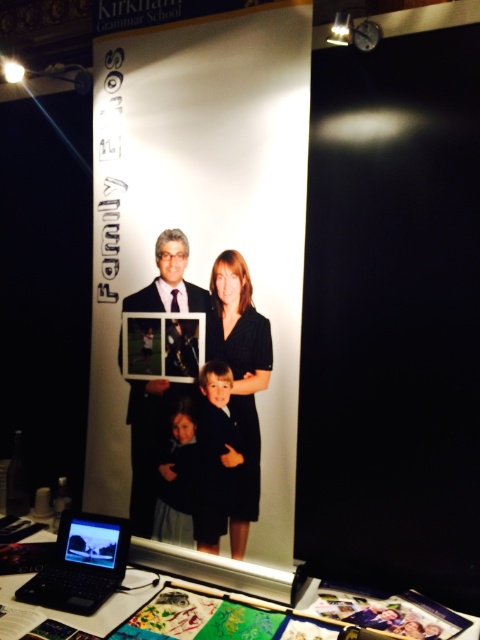
Is the position of black matte dress at center less distant than that of metallic photo frame at center?

Yes, it is in front of metallic photo frame at center.

Is black matte dress at center below metallic photo frame at center?

Correct, black matte dress at center is located below metallic photo frame at center.

Find the location of a particular element. The width and height of the screenshot is (480, 640). black matte dress at center is located at coordinates (240, 380).

Is silver metallic laptop at lower left to the left of metallic photo frame at center from the viewer's perspective?

Correct, you'll find silver metallic laptop at lower left to the left of metallic photo frame at center.

Does silver metallic laptop at lower left appear over metallic photo frame at center?

Incorrect, silver metallic laptop at lower left is not positioned above metallic photo frame at center.

What are the coordinates of `silver metallic laptop at lower left` in the screenshot? It's located at (81, 564).

Based on the photo, who is lower down, black matte dress at center or matte black suit at center?

black matte dress at center

Who is shorter, black matte dress at center or matte black suit at center?

With less height is black matte dress at center.

At what (x,y) coordinates should I click in order to perform the action: click on black matte dress at center. Please return your answer as a coordinate pair (x, y). This screenshot has width=480, height=640. Looking at the image, I should click on (240, 380).